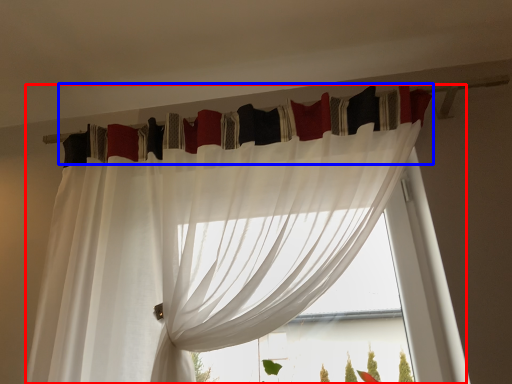
Question: Which object is further to the camera taking this photo, curtain (highlighted by a red box) or curtain (highlighted by a blue box)?

Choices:
 (A) curtain
 (B) curtain

Answer: (B)